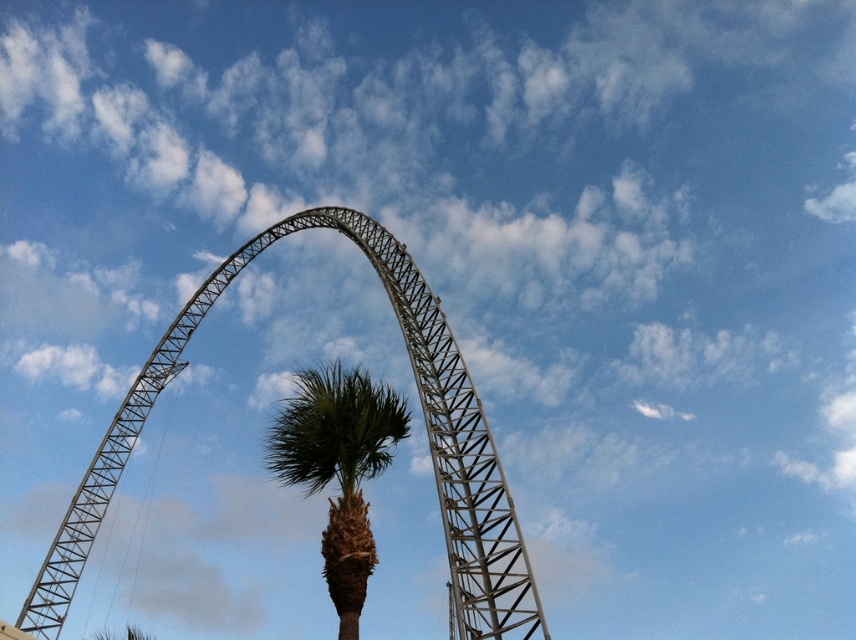
Question: Can you confirm if metallic structure at center is smaller than green leafy palm tree at center?

Choices:
 (A) yes
 (B) no

Answer: (B)

Question: Which of the following is the closest to the observer?

Choices:
 (A) metallic structure at center
 (B) green leafy palm tree at center

Answer: (A)

Question: Is the position of metallic structure at center less distant than that of green leafy palm tree at center?

Choices:
 (A) yes
 (B) no

Answer: (A)

Question: Is metallic structure at center thinner than green leafy palm tree at center?

Choices:
 (A) yes
 (B) no

Answer: (B)